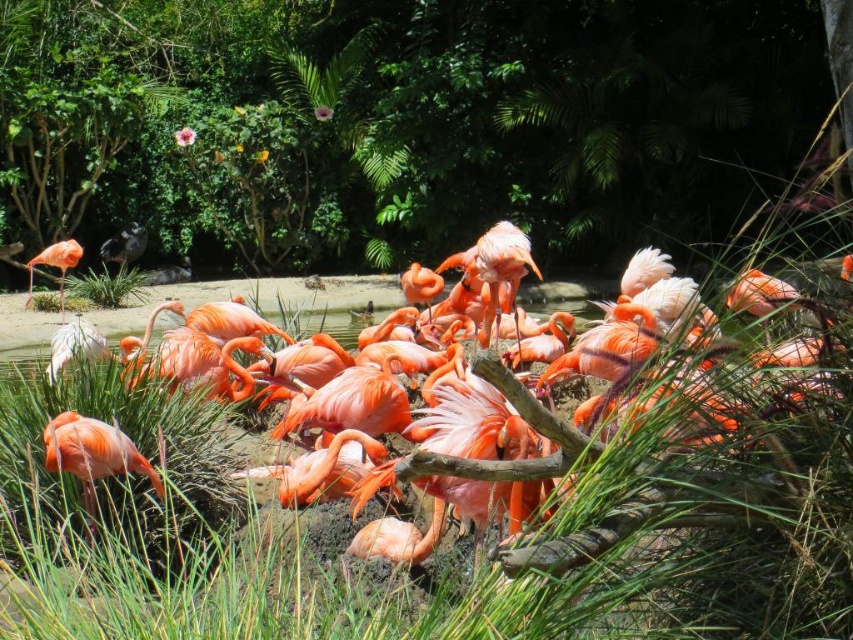
You are a photographer trying to capture the white matte bird at lower left and the matte pink flamingo at left in the same frame. Which bird should you adjust your camera angle upwards to include in your shot?

You should adjust your camera angle upwards to include the matte pink flamingo at left because the white matte bird at lower left is positioned below it.

You are a photographer aiming to capture a photo of the matte pink flamingo at lower left and the green leafy tree at upper center. Based on their positions, which object should you adjust your camera to focus on first to ensure both are in the frame?

You should focus on the matte pink flamingo at lower left first because the green leafy tree at upper center is to the right of it, so adjusting the camera to include both would require starting from the left side where the flamingo is positioned.